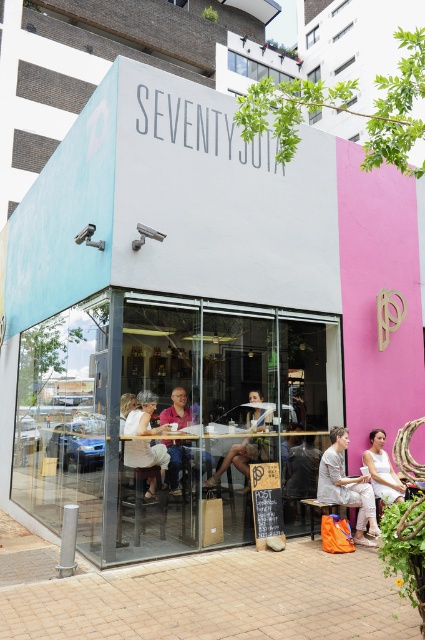
Does wooden table at center come in front of white cotton dress at center?

No, wooden table at center is behind white cotton dress at center.

Image resolution: width=425 pixels, height=640 pixels. What do you see at coordinates (244, 481) in the screenshot? I see `wooden table at center` at bounding box center [244, 481].

Is point (221, 492) positioned before point (158, 428)?

No, (221, 492) is behind (158, 428).

You are a GUI agent. You are given a task and a screenshot of the screen. Output one action in this format:
    pyautogui.click(x=<x>, y=<y>)
    Task: Click on the wooden table at center
    
    Given the screenshot: What is the action you would take?
    pyautogui.click(x=244, y=481)

Between point (376, 492) and point (170, 417), which one is positioned behind?

The point (170, 417) is more distant.

How much distance is there between white fabric dress at lower right and pink fabric shirt at center?

white fabric dress at lower right and pink fabric shirt at center are 2.24 meters apart.

Who is more distant from viewer, (399, 500) or (175, 397)?

Positioned behind is point (175, 397).

Where is `white fabric dress at lower right`? The width and height of the screenshot is (425, 640). white fabric dress at lower right is located at coordinates (382, 468).

Describe the element at coordinates (244, 481) in the screenshot. I see `wooden table at center` at that location.

Locate an element on the screen. This screenshot has height=640, width=425. wooden table at center is located at coordinates (244, 481).